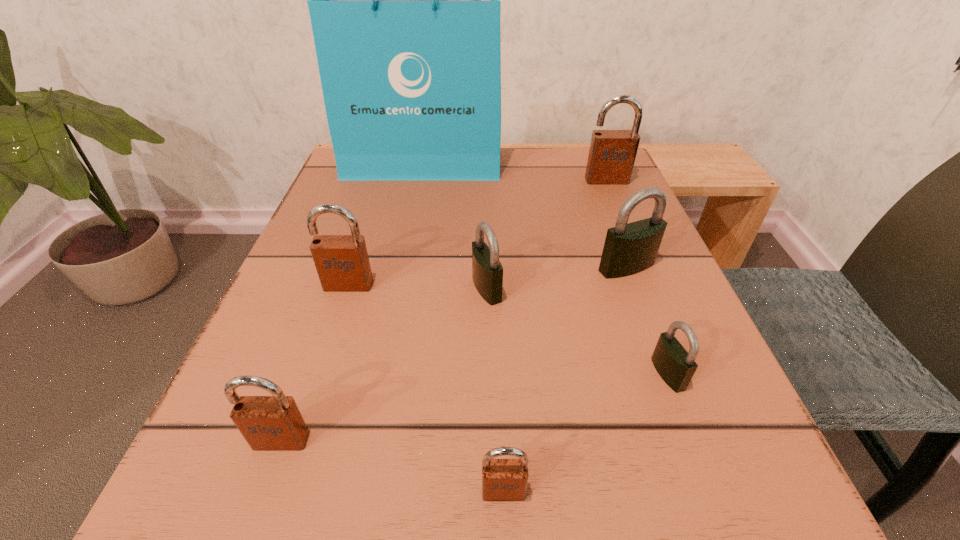
Identify the location of the fifth farthest padlock. The image size is (960, 540). (676, 366).

Identify the location of the nearest object. The height and width of the screenshot is (540, 960). (502, 479).

At what (x,y) coordinates should I click in order to perform the action: click on the third brown padlock from left to right. Please return your answer as a coordinate pair (x, y). Looking at the image, I should click on (502, 479).

Locate an element on the screen. The height and width of the screenshot is (540, 960). free space located on the front of the blue shopping bag is located at coordinates (417, 218).

This screenshot has height=540, width=960. What are the coordinates of `vacant space located on the front-facing side of the farthest brown padlock` in the screenshot? It's located at [x=659, y=303].

Image resolution: width=960 pixels, height=540 pixels. In order to click on vacant area located on the back of the biggest black padlock in this screenshot , I will do `click(614, 235)`.

Locate an element on the screen. free point located on the front-facing side of the third smallest brown padlock is located at coordinates (319, 378).

Where is `vacant space located on the front of the leftmost black padlock`? vacant space located on the front of the leftmost black padlock is located at coordinates (488, 336).

You are a GUI agent. You are given a task and a screenshot of the screen. Output one action in this format:
    pyautogui.click(x=<x>, y=<y>)
    Task: Click on the blank space located 0.210m on the left of the smallest black padlock
    
    Given the screenshot: What is the action you would take?
    pyautogui.click(x=494, y=374)

The image size is (960, 540). Find the location of `shopping bag at the far edge`. shopping bag at the far edge is located at coordinates (404, 0).